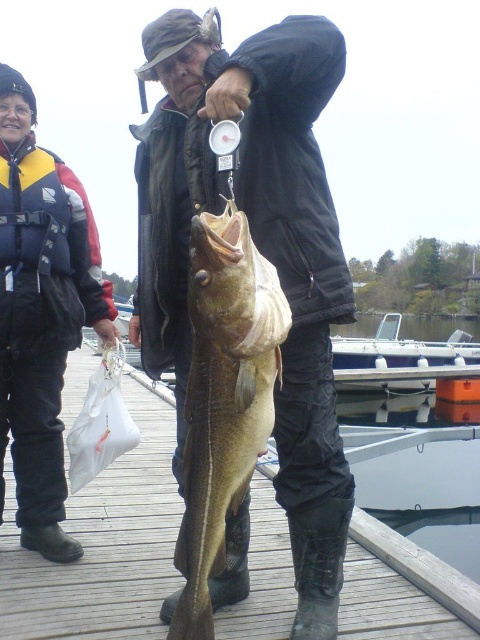
Question: Is matte black jacket at center bigger than black nylon jacket at left?

Choices:
 (A) no
 (B) yes

Answer: (A)

Question: Which object appears closest to the camera in this image?

Choices:
 (A) greenish-yellow flesh at center
 (B) matte black jacket at center
 (C) black nylon jacket at left
 (D) wooden dock at center

Answer: (A)

Question: From the image, what is the correct spatial relationship of matte black jacket at center in relation to wooden dock at center?

Choices:
 (A) left
 (B) right

Answer: (B)

Question: Which of the following is the closest to the observer?

Choices:
 (A) matte black jacket at center
 (B) wooden dock at center
 (C) black nylon jacket at left
 (D) greenish-yellow flesh at center

Answer: (D)

Question: Among these points, which one is farthest from the camera?

Choices:
 (A) (60, 592)
 (B) (324, 608)

Answer: (A)

Question: Is matte black jacket at center positioned before black nylon jacket at left?

Choices:
 (A) no
 (B) yes

Answer: (B)